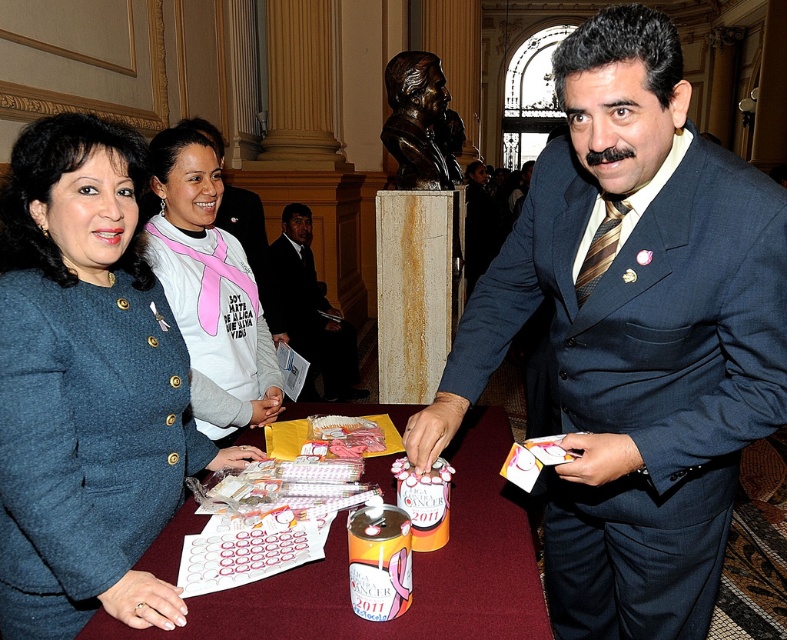
I want to click on dark blue suit at center, so click(x=634, y=333).

Which is more to the left, dark blue suit at center or matte blue coat at center?

From the viewer's perspective, matte blue coat at center appears more on the left side.

Who is more forward, (711, 378) or (95, 513)?

Point (95, 513)

Where is `dark blue suit at center`? The height and width of the screenshot is (640, 787). dark blue suit at center is located at coordinates (634, 333).

Which is behind, point (252, 328) or point (342, 376)?

The point (342, 376) is behind.

Is point (209, 144) behind point (300, 340)?

No, it is not.

At what (x,y) coordinates should I click in order to perform the action: click on pink fabric shirt at center. Please return your answer as a coordinate pair (x, y). The image size is (787, 640). Looking at the image, I should click on (209, 289).

Between point (616, 625) and point (294, 259), which one is positioned behind?

The point (294, 259) is more distant.

Between dark blue suit at center and dark suit at center, which one appears on the left side from the viewer's perspective?

dark suit at center

The image size is (787, 640). What do you see at coordinates (634, 333) in the screenshot?
I see `dark blue suit at center` at bounding box center [634, 333].

This screenshot has width=787, height=640. Find the location of `dark blue suit at center`. dark blue suit at center is located at coordinates point(634,333).